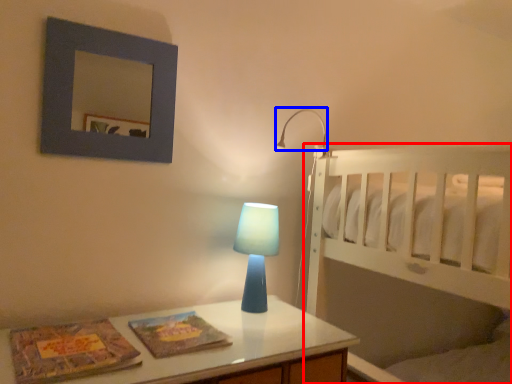
Question: Which object is closer to the camera taking this photo, bed (highlighted by a red box) or lamp (highlighted by a blue box)?

Choices:
 (A) bed
 (B) lamp

Answer: (A)